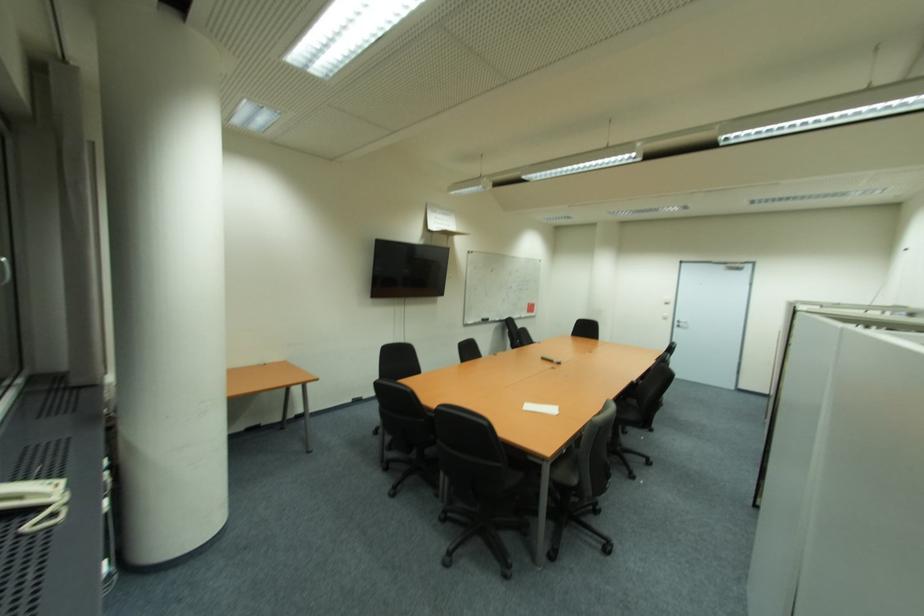
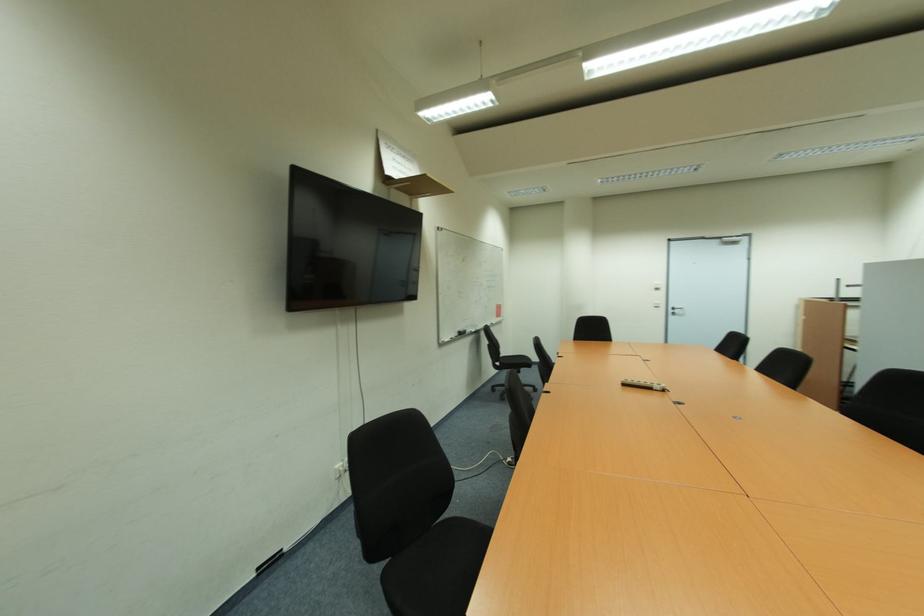
What movement of the cameraman would produce the second image?

The cameraman moved toward left, forward.